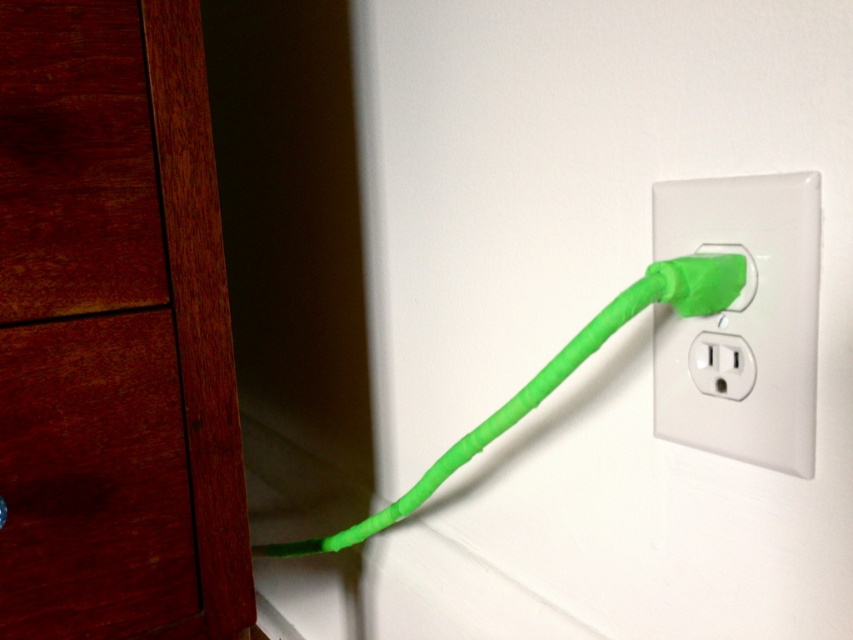
Question: Can you confirm if mahogany wood drawer at left is positioned to the left of green rubber plug at right?

Choices:
 (A) no
 (B) yes

Answer: (B)

Question: Which object is positioned closest to the green rubber plug at right?

Choices:
 (A) mahogany wood dresser at left
 (B) mahogany wood drawer at left

Answer: (A)

Question: Estimate the real-world distances between objects in this image. Which object is farther from the mahogany wood dresser at left?

Choices:
 (A) green rubber plug at right
 (B) mahogany wood drawer at left

Answer: (A)

Question: Based on their relative distances, which object is farther from the mahogany wood dresser at left?

Choices:
 (A) mahogany wood drawer at left
 (B) green rubber plug at right

Answer: (B)

Question: Is mahogany wood drawer at left below green rubber plug at right?

Choices:
 (A) yes
 (B) no

Answer: (A)

Question: Can you confirm if mahogany wood drawer at left is wider than green rubber plug at right?

Choices:
 (A) yes
 (B) no

Answer: (A)